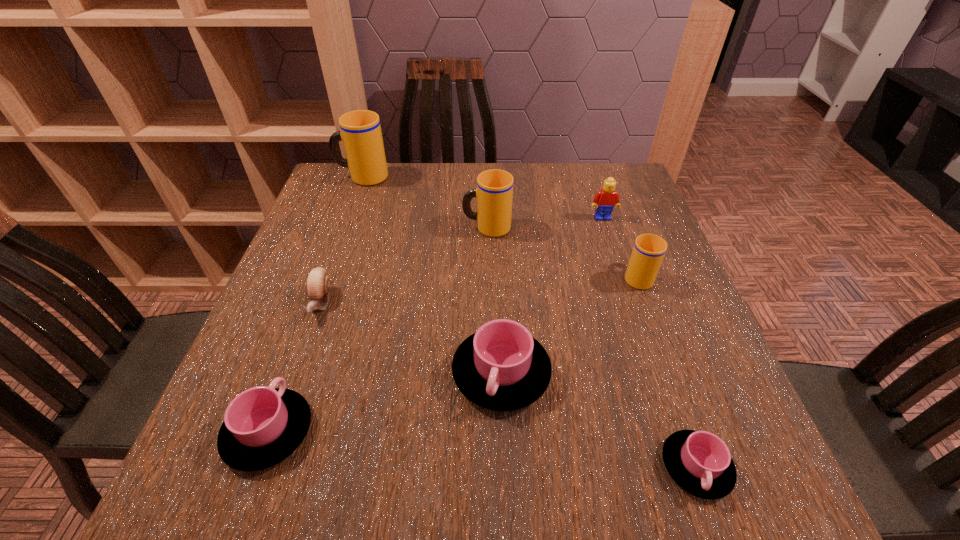
Where is `the farthest beige cup`? The height and width of the screenshot is (540, 960). the farthest beige cup is located at coordinates (361, 134).

This screenshot has width=960, height=540. In order to click on the biggest beige cup in this screenshot , I will do `click(361, 134)`.

The image size is (960, 540). Find the location of `the second beige cup from left to right`. the second beige cup from left to right is located at coordinates (494, 192).

Identify the location of the seventh shortest object. This screenshot has height=540, width=960. (494, 192).

This screenshot has height=540, width=960. I want to click on Lego, so click(x=606, y=199).

Identify the location of the smallest beige cup. (648, 252).

The width and height of the screenshot is (960, 540). I want to click on the rightmost beige cup, so click(x=648, y=252).

Find the location of a particular element. This screenshot has width=960, height=540. the second pink cup from left to right is located at coordinates (501, 367).

Where is `the fourth tallest cup`? The height and width of the screenshot is (540, 960). the fourth tallest cup is located at coordinates (x=501, y=367).

This screenshot has width=960, height=540. In order to click on the second biggest pink cup in this screenshot , I will do `click(263, 425)`.